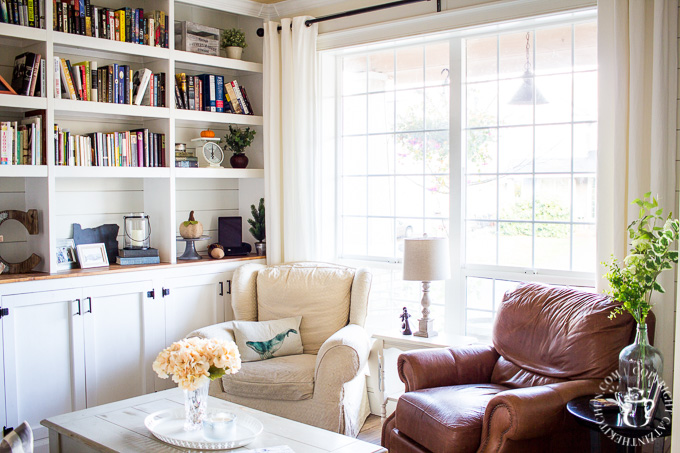
This screenshot has width=680, height=453. In order to click on window in this screenshot , I will do `click(400, 128)`, `click(521, 136)`.